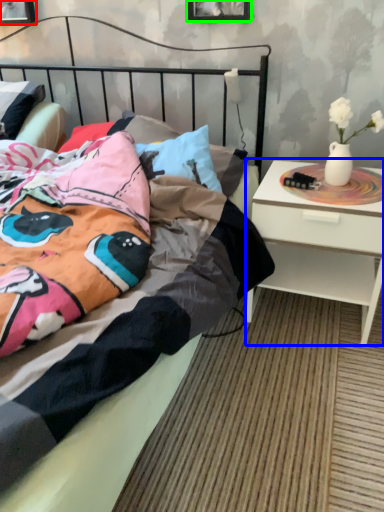
Question: Which object is the farthest from picture frame (highlighted by a red box)? Choose among these: nightstand (highlighted by a blue box) or picture frame (highlighted by a green box).

Choices:
 (A) nightstand
 (B) picture frame

Answer: (A)